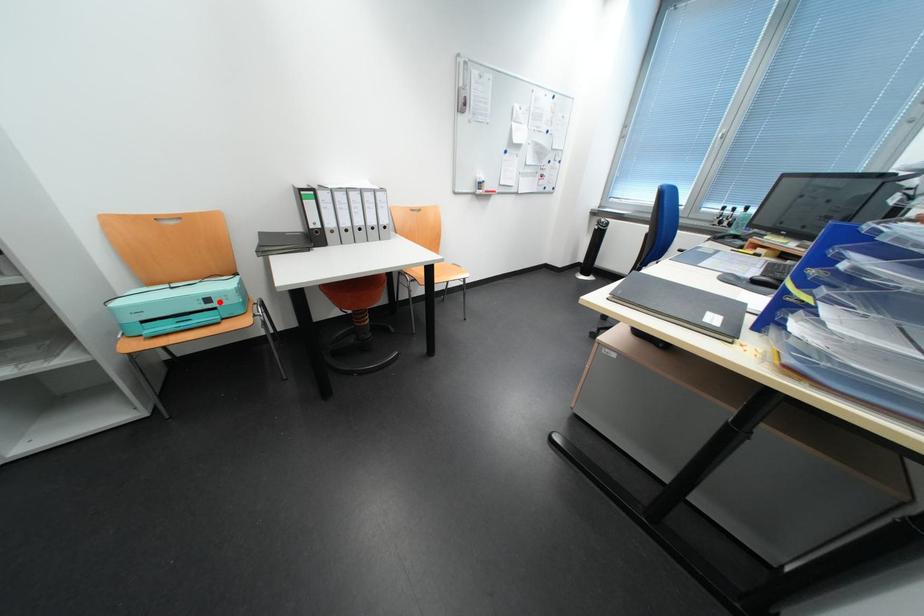
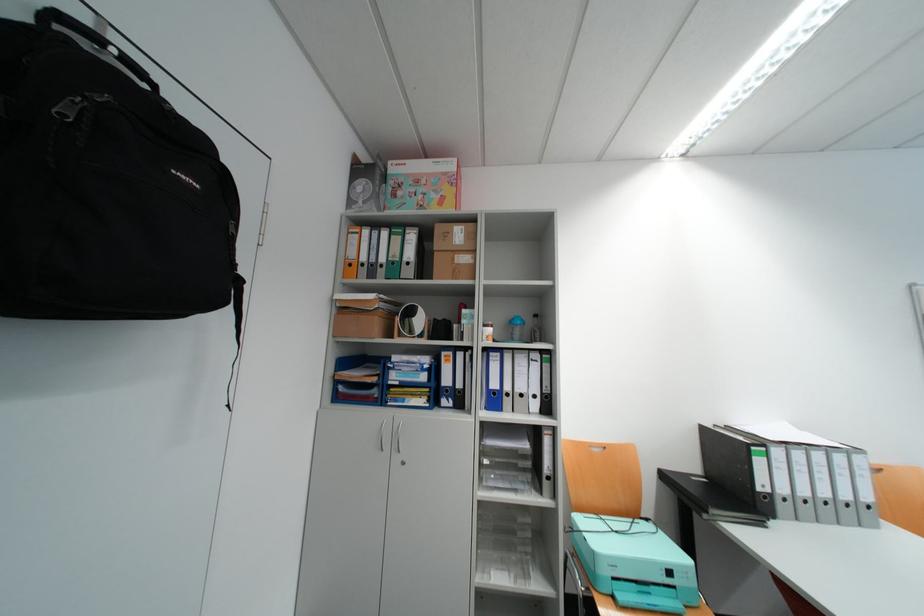
Locate, in the second image, the point that corresponds to the highlighted location in the first image.

(682, 573)